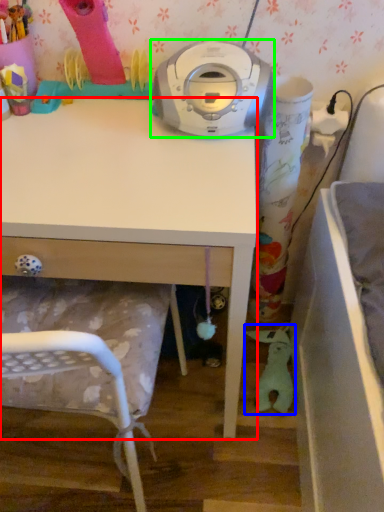
Question: Based on their relative distances, which object is farther from desk (highlighted by a red box)? Choose from toy (highlighted by a blue box) and home appliance (highlighted by a green box).

Choices:
 (A) toy
 (B) home appliance

Answer: (A)